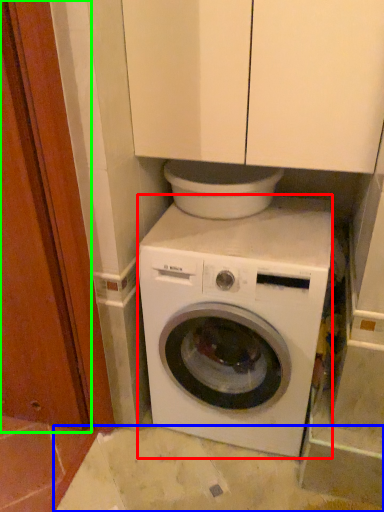
Question: Which object is positioned closest to washing machine (highlighted by a red box)? Select from concrete (highlighted by a blue box) and screen door (highlighted by a green box).

Choices:
 (A) concrete
 (B) screen door

Answer: (A)